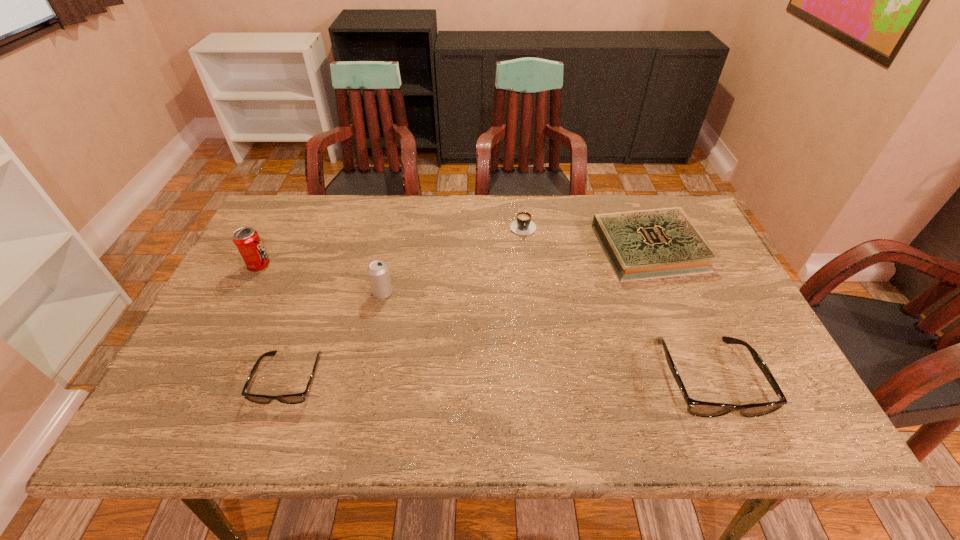
Locate an element on the screen. the shorter spectacles is located at coordinates (297, 398).

This screenshot has width=960, height=540. I want to click on the left spectacles, so pyautogui.click(x=297, y=398).

At what (x,y) coordinates should I click in order to perform the action: click on the right spectacles. Please return your answer as a coordinate pair (x, y). The image size is (960, 540). Looking at the image, I should click on (697, 408).

The height and width of the screenshot is (540, 960). Find the location of `the third tallest object`. the third tallest object is located at coordinates (697, 408).

In order to click on the fourth object from left to right in this screenshot , I will do `click(523, 225)`.

Image resolution: width=960 pixels, height=540 pixels. I want to click on the third nearest object, so click(x=378, y=273).

Locate an element on the screen. The image size is (960, 540). the third object from left to right is located at coordinates (378, 273).

Find the location of a particular element. Image resolution: width=960 pixels, height=540 pixels. hardback book is located at coordinates (646, 244).

Find the location of a particular element. Image resolution: width=960 pixels, height=540 pixels. soda can is located at coordinates (246, 240).

Find the location of a particular element. the leftmost object is located at coordinates (246, 240).